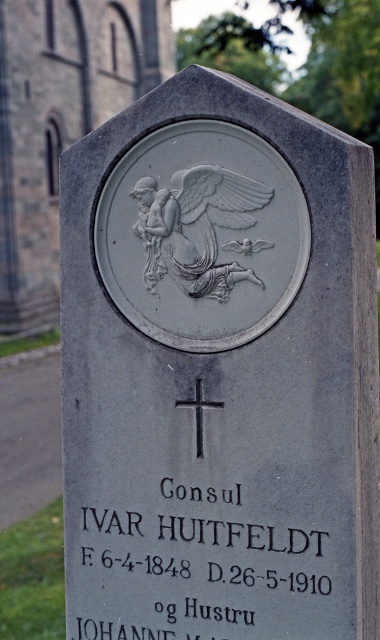
Question: Does black stone text at center have a lesser width compared to white glossy eagle at center?

Choices:
 (A) yes
 (B) no

Answer: (B)

Question: Which of the following is the farthest from the observer?

Choices:
 (A) (190, 284)
 (B) (243, 608)
 (C) (7, 218)

Answer: (C)

Question: Which of the following is the farthest from the observer?

Choices:
 (A) (147, 240)
 (B) (199, 442)
 (C) (38, 285)
 (D) (166, 637)

Answer: (C)

Question: Is white glossy eagle at center wider than black metal cross at center?

Choices:
 (A) yes
 (B) no

Answer: (A)

Question: Can you confirm if black stone text at center is bigger than white glossy eagle at center?

Choices:
 (A) no
 (B) yes

Answer: (B)

Question: Among these objects, which one is nearest to the camera?

Choices:
 (A) white glossy eagle at center
 (B) matte gray angel at upper center
 (C) black stone text at center

Answer: (C)